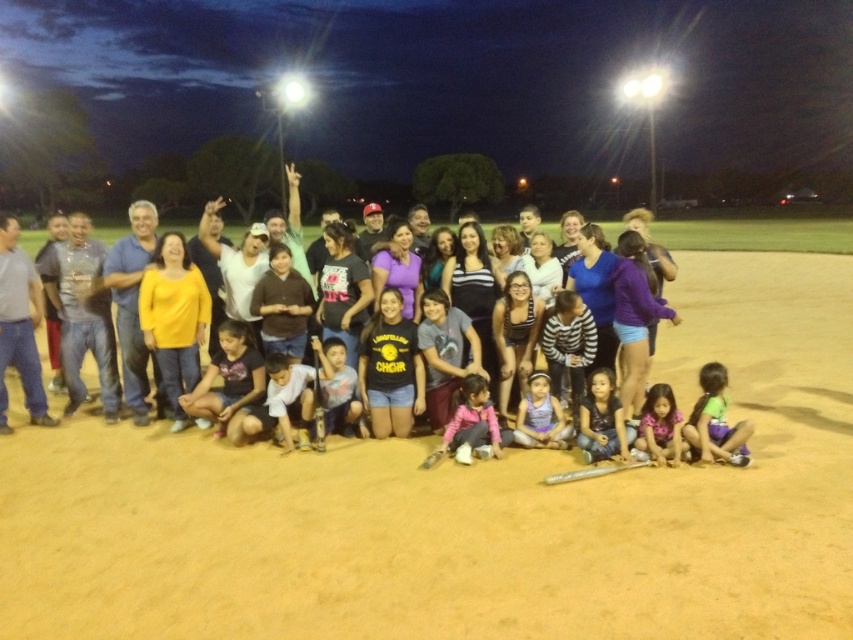
Is matte blue jeans at lower center to the right of pink fleece jacket at center from the viewer's perspective?

Correct, you'll find matte blue jeans at lower center to the right of pink fleece jacket at center.

Between matte blue jeans at lower center and pink fleece jacket at center, which one is positioned higher?

matte blue jeans at lower center

Image resolution: width=853 pixels, height=640 pixels. Describe the element at coordinates (602, 420) in the screenshot. I see `matte blue jeans at lower center` at that location.

Locate an element on the screen. matte blue jeans at lower center is located at coordinates (602, 420).

This screenshot has height=640, width=853. Describe the element at coordinates (390, 369) in the screenshot. I see `black matte shirt at center` at that location.

Based on the photo, who is positioned more to the right, black matte shirt at center or purple fabric dress at center?

purple fabric dress at center is more to the right.

Who is more forward, (x=389, y=342) or (x=553, y=448)?

Point (x=553, y=448) is more forward.

Find the location of `black matte shirt at center`. black matte shirt at center is located at coordinates (390, 369).

Is brown sandy dirt at center to the right of pink fleece jacket at center from the viewer's perspective?

Yes, brown sandy dirt at center is to the right of pink fleece jacket at center.

This screenshot has height=640, width=853. Describe the element at coordinates (466, 509) in the screenshot. I see `brown sandy dirt at center` at that location.

Who is more forward, (x=15, y=392) or (x=492, y=429)?

Point (x=492, y=429) is more forward.

This screenshot has height=640, width=853. Identify the location of brown sandy dirt at center. (466, 509).